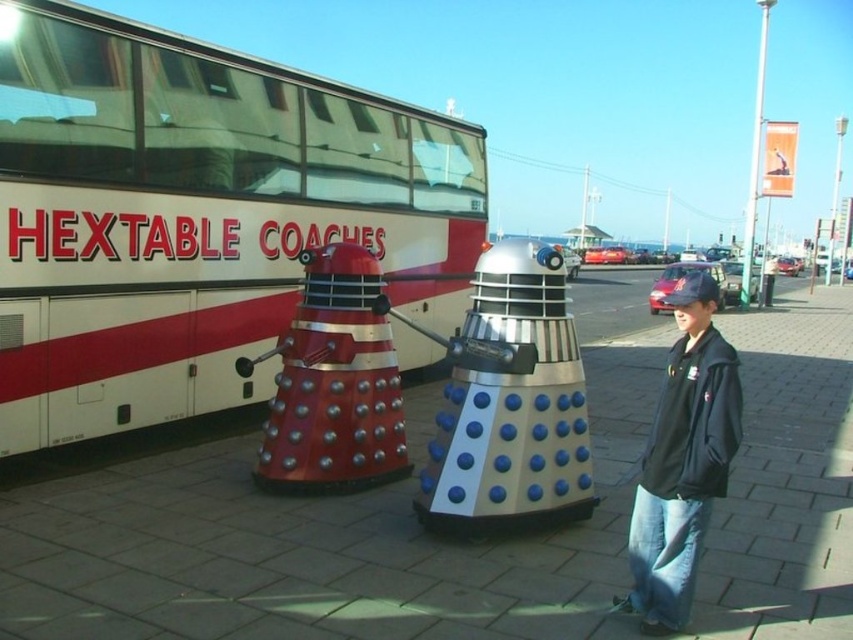
Question: Observing the image, what is the correct spatial positioning of white/red painted coach at upper left in reference to metallic red dalek at center?

Choices:
 (A) right
 (B) left

Answer: (B)

Question: Which point is closer to the camera?

Choices:
 (A) white/red painted coach at upper left
 (B) silver metallic dalek at center

Answer: (B)

Question: Which of the following is the closest to the observer?

Choices:
 (A) (312, 468)
 (B) (688, 346)
 (C) (555, 467)
 (D) (178, 308)

Answer: (B)

Question: Is silver metallic dalek at center positioned before metallic red dalek at center?

Choices:
 (A) no
 (B) yes

Answer: (B)

Question: Does metallic red dalek at center appear on the left side of black leather jacket at lower right?

Choices:
 (A) yes
 (B) no

Answer: (A)

Question: Which point is closer to the camera?

Choices:
 (A) white/red painted coach at upper left
 (B) metallic red dalek at center
 (C) black leather jacket at lower right

Answer: (C)